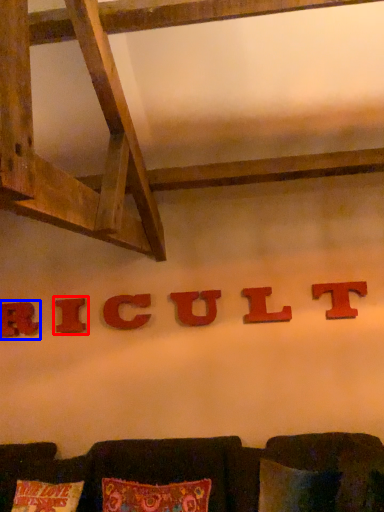
Question: Among these objects, which one is farthest to the camera, alphabet (highlighted by a red box) or alphabet (highlighted by a blue box)?

Choices:
 (A) alphabet
 (B) alphabet

Answer: (B)